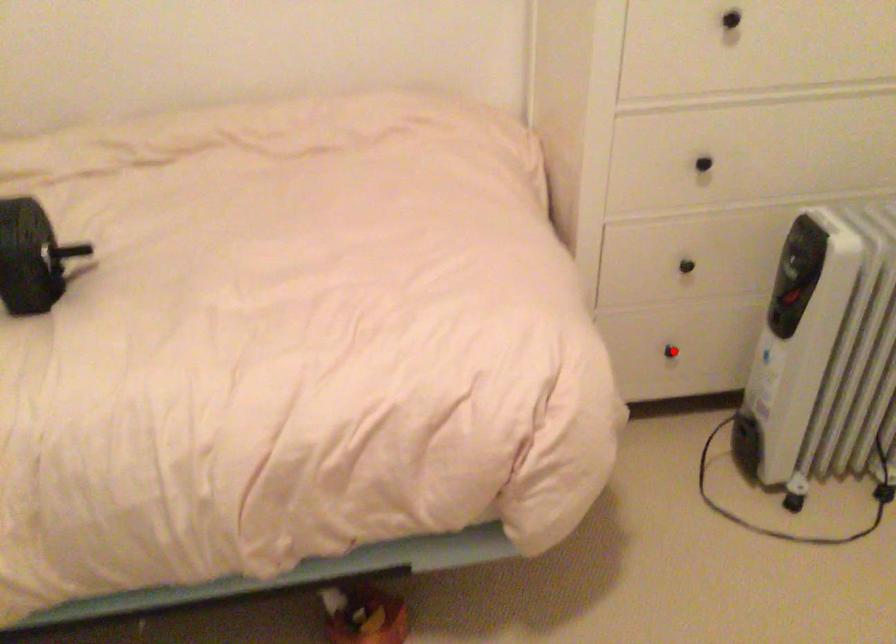
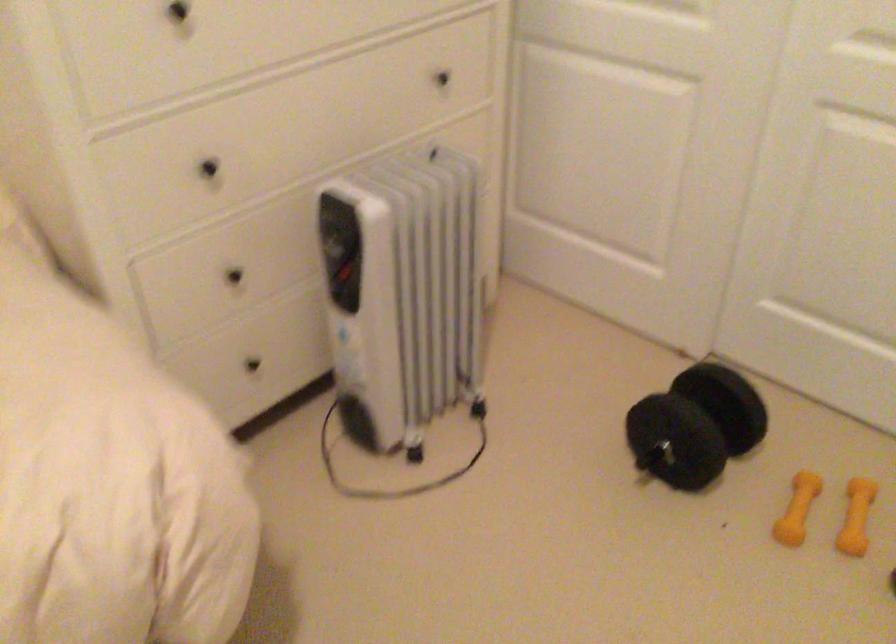
Where in the second image is the point corresponding to the highlighted location from the first image?

(252, 364)